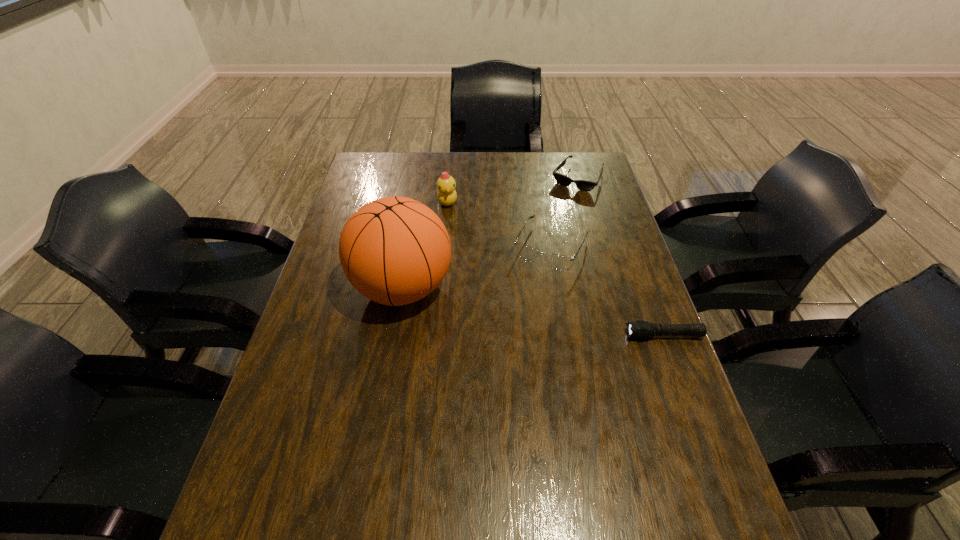
You are a GUI agent. You are given a task and a screenshot of the screen. Output one action in this format:
    pyautogui.click(x=<x>, y=<y>)
    Task: Click on the vacant region between the flashlight and the sunglasses
    
    Given the screenshot: What is the action you would take?
    pyautogui.click(x=620, y=257)

Where is `empty space between the basketball and the spectacles`? empty space between the basketball and the spectacles is located at coordinates (477, 267).

Find the location of a particular element. empty location between the sunglasses and the basketball is located at coordinates (490, 233).

In order to click on vacant area between the tallest object and the spectacles in this screenshot , I will do `click(477, 267)`.

The image size is (960, 540). I want to click on vacant area that lies between the basketball and the sunglasses, so click(x=490, y=233).

What are the coordinates of `free space between the basketball and the nearest object` in the screenshot? It's located at (x=533, y=312).

Where is `object that is the nearest to the spectacles`? object that is the nearest to the spectacles is located at coordinates (583, 185).

Select which object is the closest to the flashlight. Please provide its 2D coordinates. Your answer should be formatted as a tuple, i.e. [(x, y)], where the tuple contains the x and y coordinates of a point satisfying the conditions above.

[(558, 262)]

Locate an element on the screen. vacant point that satisfies the following two spatial constraints: 1. on the front side of the nearest object; 2. at the lens end of the tallest object is located at coordinates (395, 335).